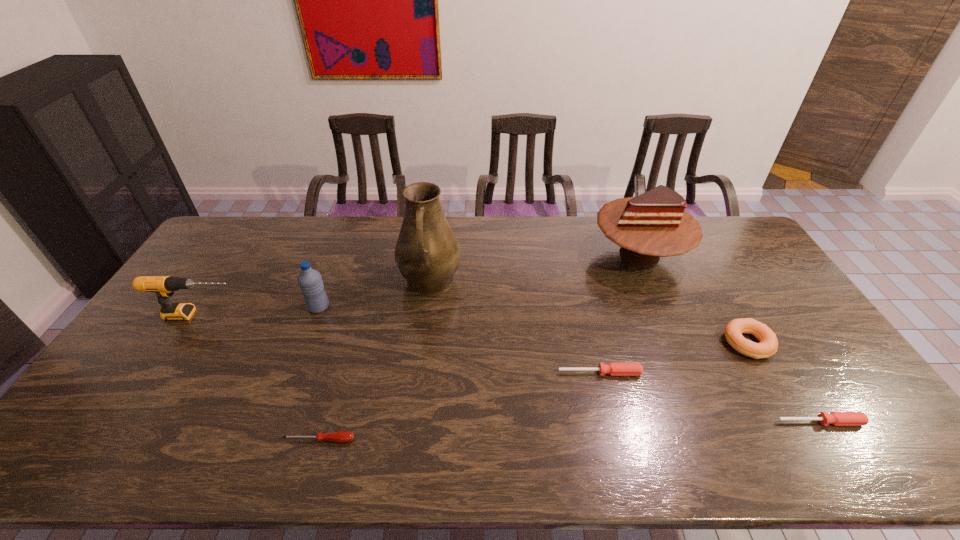
The image size is (960, 540). In the image, there is a desktop. Identify the location of blank space at the far left corner. (244, 227).

Locate an element on the screen. vacant space at the near left corner is located at coordinates (84, 438).

What are the coordinates of `vacant position at the far right corner of the desktop` in the screenshot? It's located at (738, 251).

Where is `free space that is in between the tallest object and the seventh object from right to left`? This screenshot has width=960, height=540. free space that is in between the tallest object and the seventh object from right to left is located at coordinates (374, 295).

At what (x,y) coordinates should I click in order to perform the action: click on free spot between the pitcher and the bagel. Please return your answer as a coordinate pair (x, y). This screenshot has width=960, height=540. Looking at the image, I should click on (588, 313).

Locate an element on the screen. This screenshot has height=540, width=960. blank region between the farthest screwdriver and the tallest object is located at coordinates (515, 327).

You are a GUI agent. You are given a task and a screenshot of the screen. Output one action in this format:
    pyautogui.click(x=<x>, y=<y>)
    Task: Click on the vacant point located between the second nearest screwdriver and the third nearest object
    The height and width of the screenshot is (540, 960).
    Given the screenshot: What is the action you would take?
    pyautogui.click(x=710, y=397)

Image resolution: width=960 pixels, height=540 pixels. I want to click on blank region between the fifth tallest object and the fifth shortest object, so click(x=473, y=329).

Where is `vacant point located between the farthest screwdriver and the cake`? vacant point located between the farthest screwdriver and the cake is located at coordinates (620, 313).

This screenshot has height=540, width=960. I want to click on free area in between the second nearest screwdriver and the seventh object from right to left, so click(x=570, y=364).